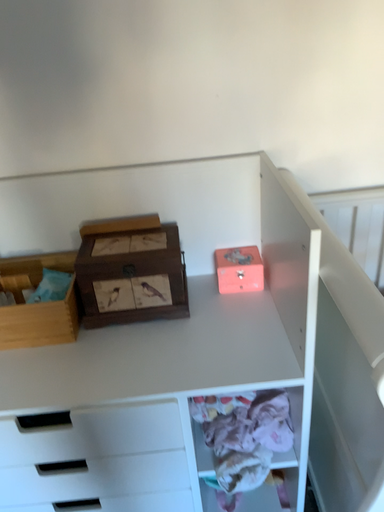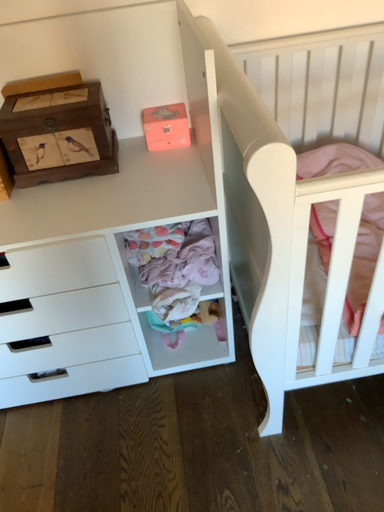
Question: Which way did the camera rotate in the video?

Choices:
 (A) rotated upward
 (B) rotated downward

Answer: (B)